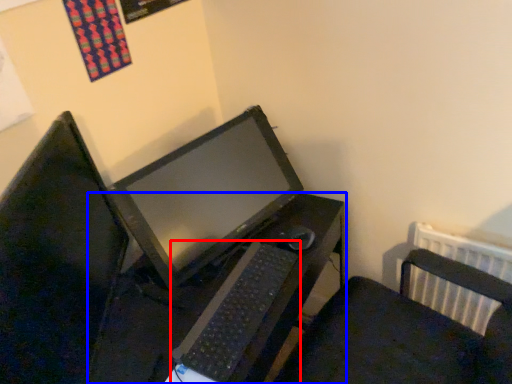
Question: Which of the following is the farthest to the observer, computer keyboard (highlighted by a red box) or desk (highlighted by a blue box)?

Choices:
 (A) computer keyboard
 (B) desk

Answer: (A)